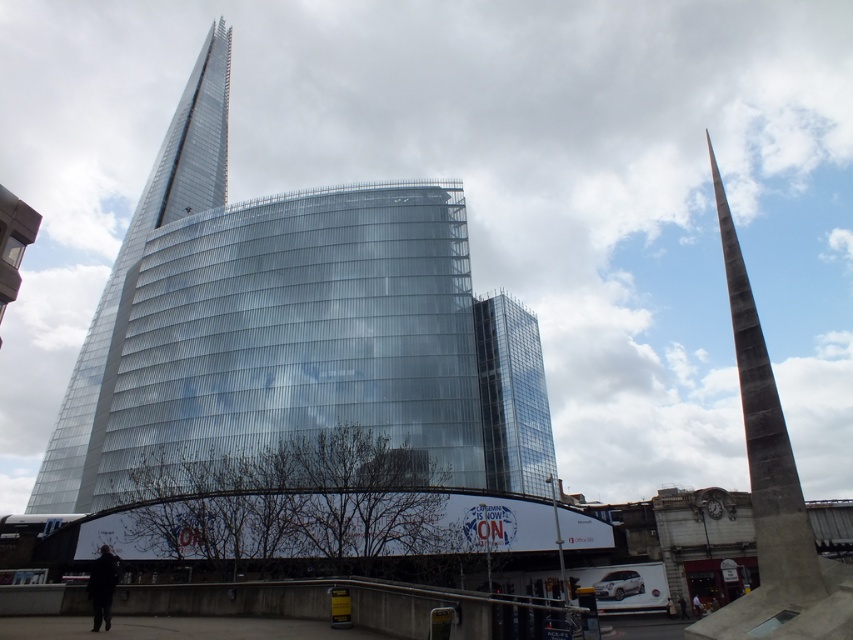
You are an architect analyzing the urban landscape. You need to determine which spire is smaller in size between the shiny glass spire at left and the rustic concrete spire at right. Which one is smaller?

The shiny glass spire at left is smaller in size compared to the rustic concrete spire at right.

You are standing in the middle of the image and see the shiny glass spire at left. Based on its 2D coordinates, in which direction should you turn to face it?

The shiny glass spire at left is located at coordinates 0.431 on the x axis and 0.162 on the y axis. Since the x value is less than 0.5, it is to the left of the center. Therefore, you should turn to your left to face the shiny glass spire at left.

In the scene shown: You are a city planner assessing the visibility of two spires in the urban landscape. The shiny glass spire at left and the rustic concrete spire at right are both part of the city skyline. Based on their positions, which spire would appear higher in the sky when viewed from the city center?

The shiny glass spire at left is located above the rustic concrete spire at right, so it would appear higher in the sky when viewed from the city center.